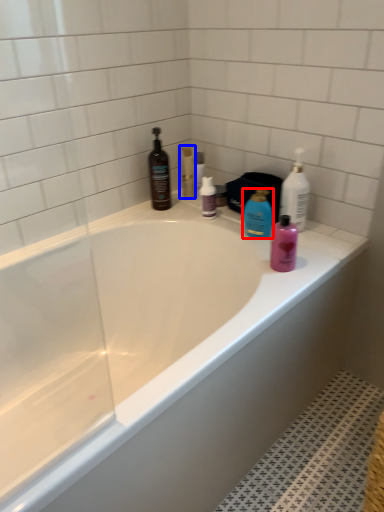
Question: Among these objects, which one is nearest to the camera, cleaning product (highlighted by a red box) or toiletry (highlighted by a blue box)?

Choices:
 (A) cleaning product
 (B) toiletry

Answer: (A)